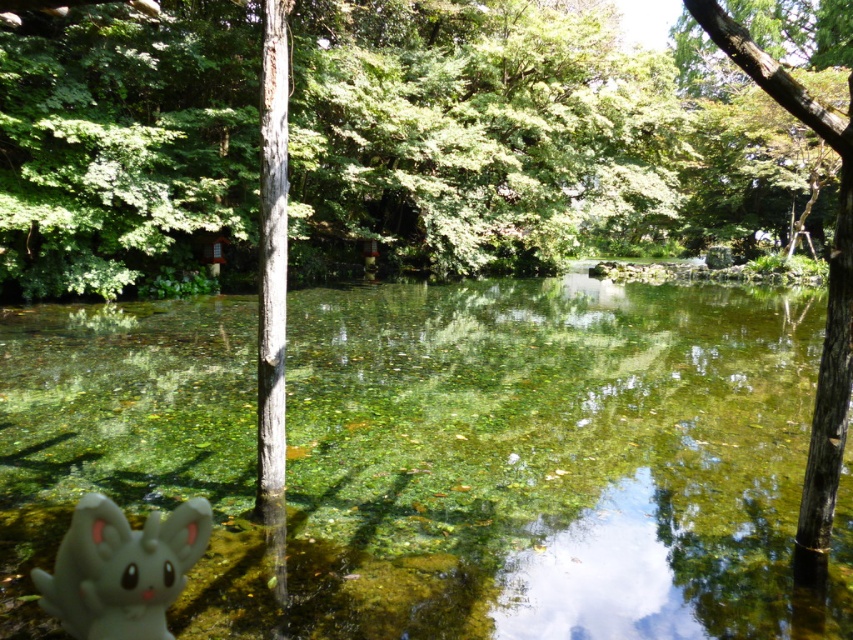
Is white rubber toy at lower left above smooth bark tree at right?

No.

Does white rubber toy at lower left have a larger size compared to smooth bark tree at right?

No, white rubber toy at lower left is not bigger than smooth bark tree at right.

Who is more forward, (190, 545) or (817, 428)?

Point (190, 545) is more forward.

Where is `white rubber toy at lower left`? This screenshot has width=853, height=640. white rubber toy at lower left is located at coordinates (120, 568).

Between point (763, 492) and point (827, 115), which one is positioned behind?

The point (763, 492) is behind.

Is clear glass water at center to the left of smooth bark tree at right from the viewer's perspective?

Indeed, clear glass water at center is positioned on the left side of smooth bark tree at right.

The image size is (853, 640). What do you see at coordinates (432, 454) in the screenshot? I see `clear glass water at center` at bounding box center [432, 454].

Where is `clear glass water at center`? The width and height of the screenshot is (853, 640). clear glass water at center is located at coordinates (432, 454).

Between clear glass water at center and white rubber toy at lower left, which one appears on the right side from the viewer's perspective?

From the viewer's perspective, white rubber toy at lower left appears more on the right side.

Is clear glass water at center below white rubber toy at lower left?

No, clear glass water at center is not below white rubber toy at lower left.

Who is more distant from viewer, (700, 429) or (160, 531)?

The point (700, 429) is behind.

The width and height of the screenshot is (853, 640). In order to click on clear glass water at center in this screenshot , I will do `click(432, 454)`.